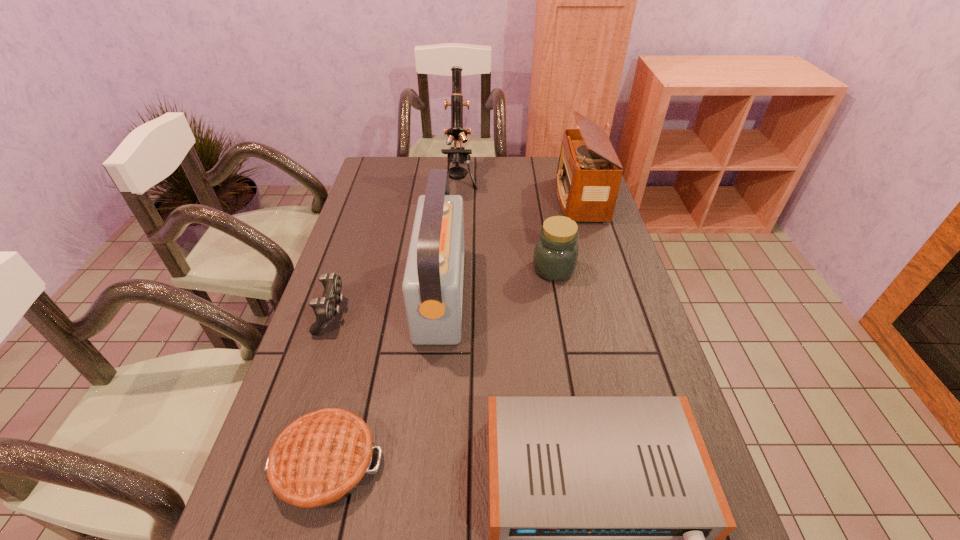
Identify the location of blank space located 0.290m on the front panel of the farthest radio receiver. The image size is (960, 540). (476, 199).

Where is `vacant space located on the back of the jar`? vacant space located on the back of the jar is located at coordinates (544, 215).

The height and width of the screenshot is (540, 960). I want to click on free space located 0.320m on the surface of the control with buttons, so click(465, 314).

In order to click on free space located on the back of the pie in this screenshot , I will do `click(357, 342)`.

Locate an element on the screen. microscope that is at the far edge is located at coordinates pos(457,155).

Locate an element on the screen. The image size is (960, 540). radio receiver located at the far edge is located at coordinates tap(589, 173).

Find the location of a particular element. This screenshot has width=960, height=540. control located at the left edge is located at coordinates (325, 308).

Where is `pie at the left edge`? The height and width of the screenshot is (540, 960). pie at the left edge is located at coordinates (318, 460).

The image size is (960, 540). I want to click on radio receiver present at the right edge, so click(589, 173).

Find the location of a particular element. jar that is at the right edge is located at coordinates point(556,251).